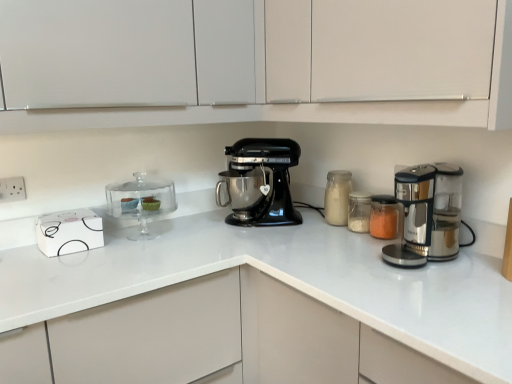
Question: Should I look upward or downward to see translucent glass jar at center, acting as the second appliance starting from the left?

Choices:
 (A) down
 (B) up

Answer: (A)

Question: Can you confirm if clear glass cake stand at left, the 3th appliance in the right-to-left sequence, is bigger than translucent glass jar at center, acting as the second appliance starting from the left?

Choices:
 (A) no
 (B) yes

Answer: (B)

Question: From a real-world perspective, does clear glass cake stand at left, the 3th appliance in the right-to-left sequence, stand above translucent glass jar at center, acting as the second appliance starting from the left?

Choices:
 (A) yes
 (B) no

Answer: (A)

Question: Is clear glass cake stand at left, the 1th appliance from the left, at the right side of translucent glass jar at center, placed as the second appliance when sorted from right to left?

Choices:
 (A) yes
 (B) no

Answer: (B)

Question: Considering the relative positions of clear glass cake stand at left, the 3th appliance in the right-to-left sequence, and translucent glass jar at center, acting as the second appliance starting from the left, in the image provided, is clear glass cake stand at left, the 3th appliance in the right-to-left sequence, in front of translucent glass jar at center, acting as the second appliance starting from the left,?

Choices:
 (A) yes
 (B) no

Answer: (A)

Question: Is clear glass cake stand at left, the 3th appliance in the right-to-left sequence, wider than translucent glass jar at center, acting as the second appliance starting from the left?

Choices:
 (A) no
 (B) yes

Answer: (B)

Question: Is clear glass cake stand at left, the 3th appliance in the right-to-left sequence, not close to translucent glass jar at center, placed as the second appliance when sorted from right to left?

Choices:
 (A) no
 (B) yes

Answer: (A)

Question: Considering the relative positions of clear glass cake stand at left, the 3th appliance in the right-to-left sequence, and black matte mixer at center in the image provided, is clear glass cake stand at left, the 3th appliance in the right-to-left sequence, to the right of black matte mixer at center from the viewer's perspective?

Choices:
 (A) yes
 (B) no

Answer: (B)

Question: From the image's perspective, would you say clear glass cake stand at left, the 3th appliance in the right-to-left sequence, is shown under black matte mixer at center?

Choices:
 (A) no
 (B) yes

Answer: (B)

Question: Can you confirm if clear glass cake stand at left, the 1th appliance from the left, is thinner than black matte mixer at center?

Choices:
 (A) yes
 (B) no

Answer: (A)

Question: Is black matte mixer at center at the back of clear glass cake stand at left, the 3th appliance in the right-to-left sequence?

Choices:
 (A) yes
 (B) no

Answer: (B)

Question: Considering the relative sizes of clear glass cake stand at left, the 3th appliance in the right-to-left sequence, and black matte mixer at center in the image provided, is clear glass cake stand at left, the 3th appliance in the right-to-left sequence, wider than black matte mixer at center?

Choices:
 (A) yes
 (B) no

Answer: (B)

Question: From a real-world perspective, is clear glass cake stand at left, the 3th appliance in the right-to-left sequence, on black matte mixer at center?

Choices:
 (A) no
 (B) yes

Answer: (A)

Question: Is white matte cabinet at upper center, the second cabinetry positioned from the left, shorter than translucent glass jar at center, placed as the 1th appliance when sorted from right to left?

Choices:
 (A) no
 (B) yes

Answer: (A)